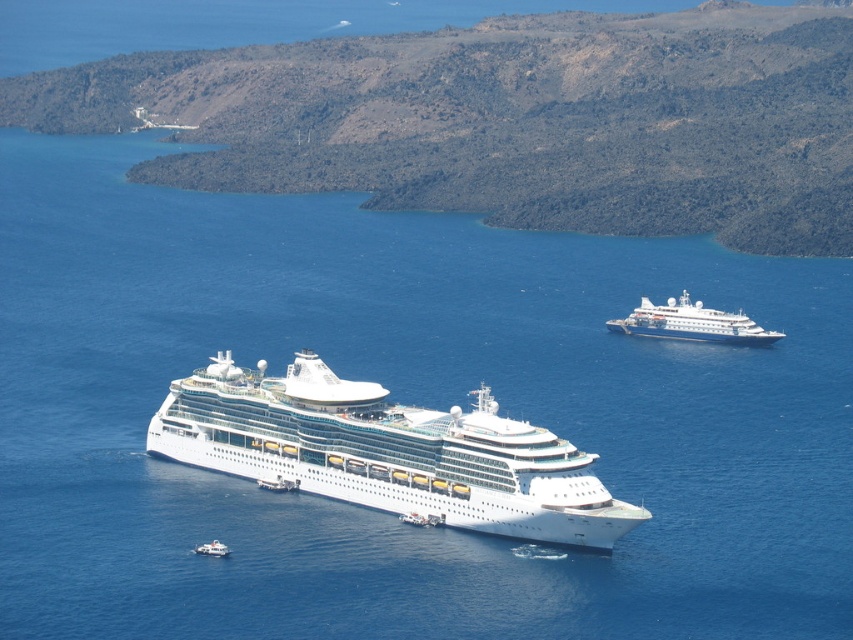
Is point (482, 387) in front of point (196, 548)?

No, (482, 387) is behind (196, 548).

Who is more distant from viewer, (467, 454) or (202, 545)?

The point (202, 545) is more distant.

Locate an element on the screen. The width and height of the screenshot is (853, 640). white glossy cruise ship at center is located at coordinates (387, 452).

Consider the image. Does white glossy cruise ship at center appear under white glossy cruise ship at upper right?

Indeed, white glossy cruise ship at center is positioned under white glossy cruise ship at upper right.

Describe the element at coordinates (387, 452) in the screenshot. The image size is (853, 640). I see `white glossy cruise ship at center` at that location.

At what (x,y) coordinates should I click in order to perform the action: click on white glossy cruise ship at center. Please return your answer as a coordinate pair (x, y). Looking at the image, I should click on (387, 452).

How distant is white glossy cruise ship at upper right from white glossy boat at lower left?

The distance of white glossy cruise ship at upper right from white glossy boat at lower left is 446.87 feet.

Which of these two, white glossy cruise ship at upper right or white glossy boat at lower left, stands shorter?

Standing shorter between the two is white glossy boat at lower left.

I want to click on white glossy cruise ship at upper right, so click(691, 323).